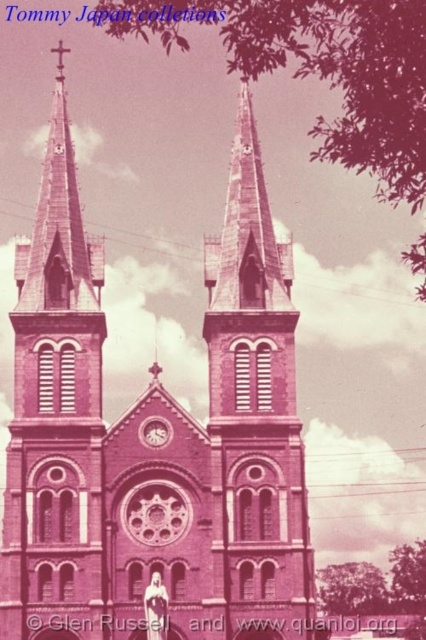
You are standing in front of the pink stone church at center and pink stone church steeple at center. Which one is positioned more to the left?

The pink stone church steeple at center is positioned more to the left than the pink stone church at center.

In the scene shown: You are standing in front of the grand church and want to take a photo of both the pink stone church steeple at center and the matte glass clock at center. Which object should you focus on first if you want to capture both in the same frame without moving the camera?

You should focus on the pink stone church steeple at center first because it is closer to the viewer than the matte glass clock at center. By focusing on the closer object, the farther one will still be in focus due to the depth of field, allowing both to be captured in the same frame.